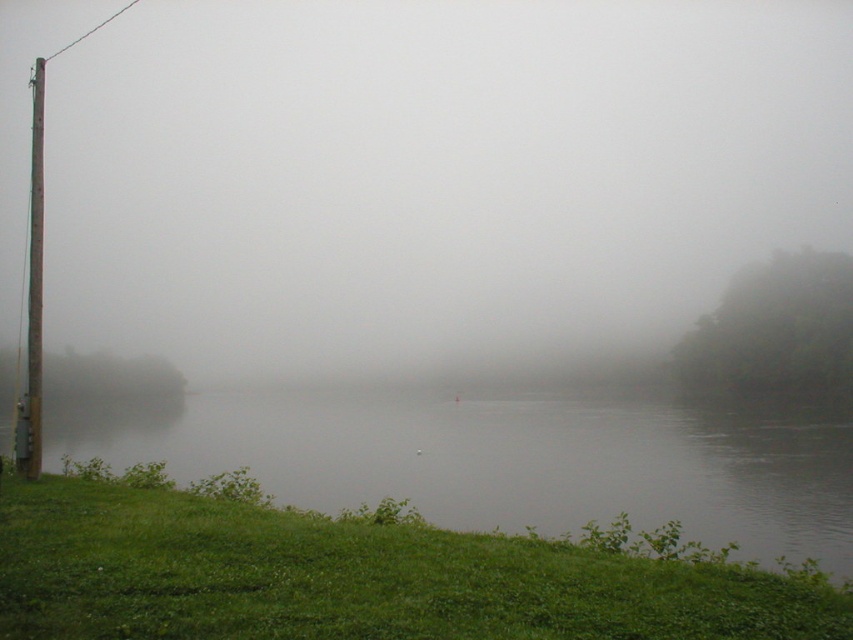
Question: Can you confirm if green grassy hillside at lower left is bigger than brown rough wooden pole at left?

Choices:
 (A) no
 (B) yes

Answer: (A)

Question: Which of the following is the farthest from the observer?

Choices:
 (A) (753, 424)
 (B) (33, 419)
 (C) (424, 637)

Answer: (A)

Question: Based on their relative distances, which object is farther from the green grassy bank at lower left?

Choices:
 (A) green grassy hillside at lower left
 (B) brown rough wooden pole at left

Answer: (A)

Question: Where is green grassy hillside at lower left located in relation to brown rough wooden pole at left in the image?

Choices:
 (A) above
 (B) below

Answer: (B)

Question: Which point is farther to the camera?

Choices:
 (A) brown rough wooden pole at left
 (B) green grassy bank at lower left
 (C) green grassy hillside at lower left

Answer: (A)

Question: Is green grassy bank at lower left wider than green grassy hillside at lower left?

Choices:
 (A) yes
 (B) no

Answer: (A)